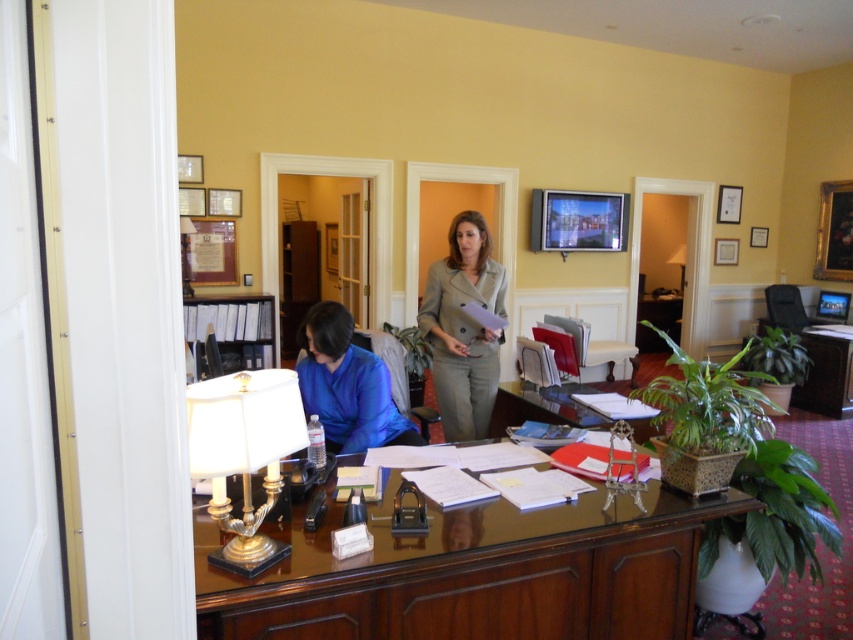
Question: Which object is the farthest from the glossy wood table at center?

Choices:
 (A) light gray suit at center
 (B) matte white lamp at upper right
 (C) gold metallic lamp at left

Answer: (B)

Question: Which object is farther from the camera taking this photo?

Choices:
 (A) light gray suit at center
 (B) matte blue blouse at left
 (C) glossy wood table at center

Answer: (A)

Question: Which object is the closest to the matte white lamp at upper right?

Choices:
 (A) matte blue blouse at left
 (B) light gray suit at center

Answer: (B)

Question: Does glossy wood table at center have a larger size compared to matte white lamp at upper right?

Choices:
 (A) yes
 (B) no

Answer: (A)

Question: Does matte blue blouse at left come in front of matte white lamp at upper right?

Choices:
 (A) no
 (B) yes

Answer: (B)

Question: In this image, where is gold metallic lamp at left located relative to matte blue blouse at left?

Choices:
 (A) right
 (B) left

Answer: (B)